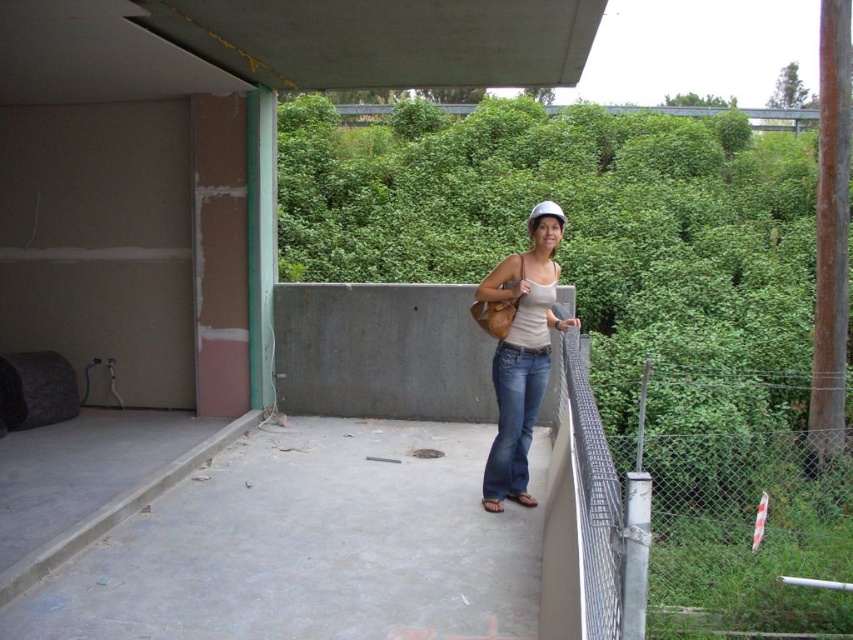
You are a safety inspector checking the equipment of a worker. The worker is wearing a matte white helmet at center and has blue denim jeans at center. According to safety regulations, the minimum required distance between the helmet and the top of the jeans must be at least 3 inches to ensure proper coverage. Is the worker compliant with this regulation?

The distance between the matte white helmet at center and blue denim jeans at center is 2.56 inches, which is less than the required 3 inches. Therefore, the worker is not compliant with the safety regulation.

You are a safety inspector evaluating the scene. You notice the point marked at coordinates (519, 349). What object does this point correspond to?

The point at coordinates (519, 349) corresponds to the matte white helmet at center.

You are standing on a concrete platform and want to check the distance between you and the wire mesh fence at right. Your measuring tool can only measure up to 5 feet. Can you use it to measure the distance?

The distance between you and the wire mesh fence at right is 4.80 feet, which is within the measuring tool range of 5 feet. Therefore, you can use it to measure the distance.